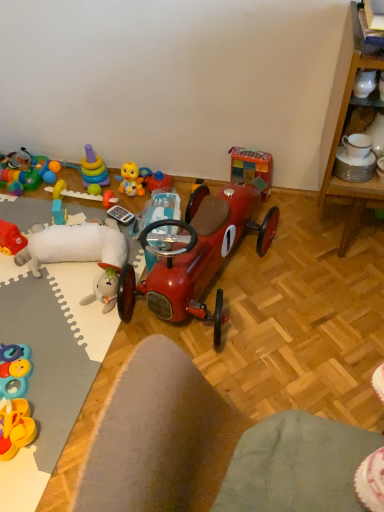
The width and height of the screenshot is (384, 512). In order to click on free space in front of rubber duck at lower left, which is counted as the 7th toy, starting from the right in this screenshot , I will do `click(24, 481)`.